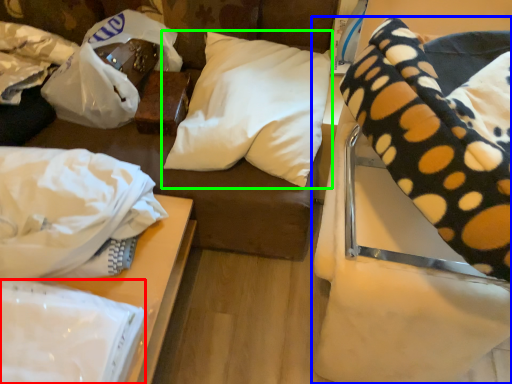
Question: Estimate the real-world distances between objects in this image. Which object is closer to linen (highlighted by a red box), furniture (highlighted by a blue box) or pillow (highlighted by a green box)?

Choices:
 (A) furniture
 (B) pillow

Answer: (A)